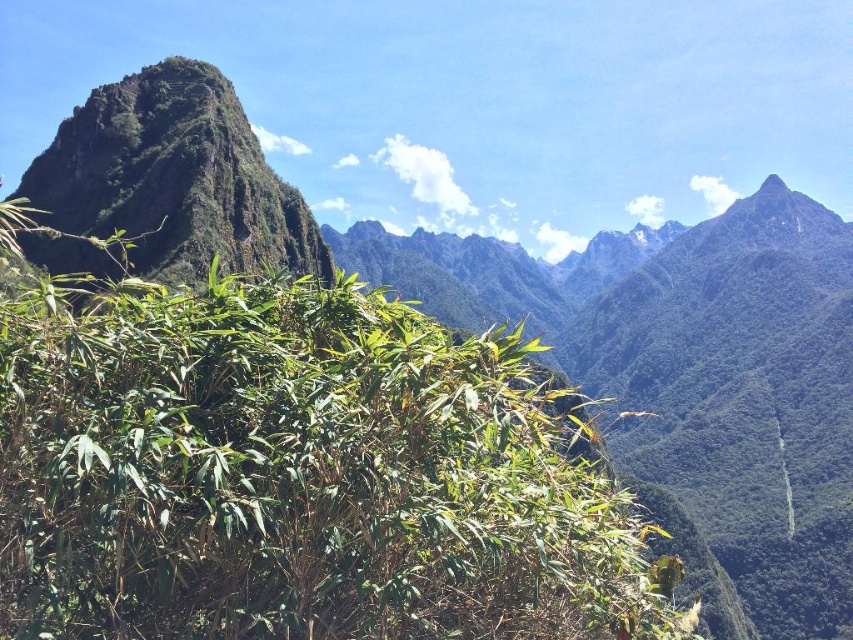
Question: Is green leafy plant at center wider than green rough rock at upper left?

Choices:
 (A) no
 (B) yes

Answer: (B)

Question: Observing the image, what is the correct spatial positioning of green leafy plant at center in reference to green rough rock at upper left?

Choices:
 (A) above
 (B) below

Answer: (B)

Question: Which point appears farthest from the camera in this image?

Choices:
 (A) (152, 237)
 (B) (248, 330)

Answer: (A)

Question: Which point is farther from the camera taking this photo?

Choices:
 (A) (506, 426)
 (B) (35, 243)

Answer: (B)

Question: From the image, what is the correct spatial relationship of green leafy plant at center in relation to green rough rock at upper left?

Choices:
 (A) below
 (B) above

Answer: (A)

Question: Among these objects, which one is farthest from the camera?

Choices:
 (A) green rough rock at upper left
 (B) green leafy plant at center

Answer: (A)